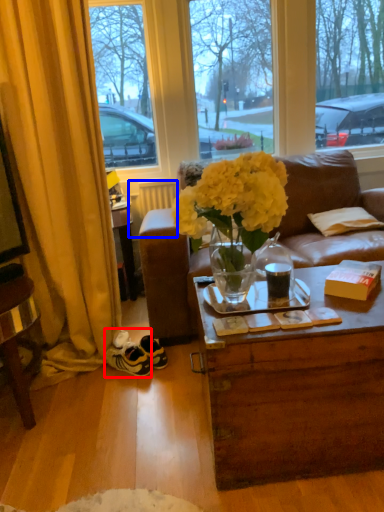
Question: Which object appears closest to the camera in this image, sneakers (highlighted by a red box) or radiator (highlighted by a blue box)?

Choices:
 (A) sneakers
 (B) radiator

Answer: (A)